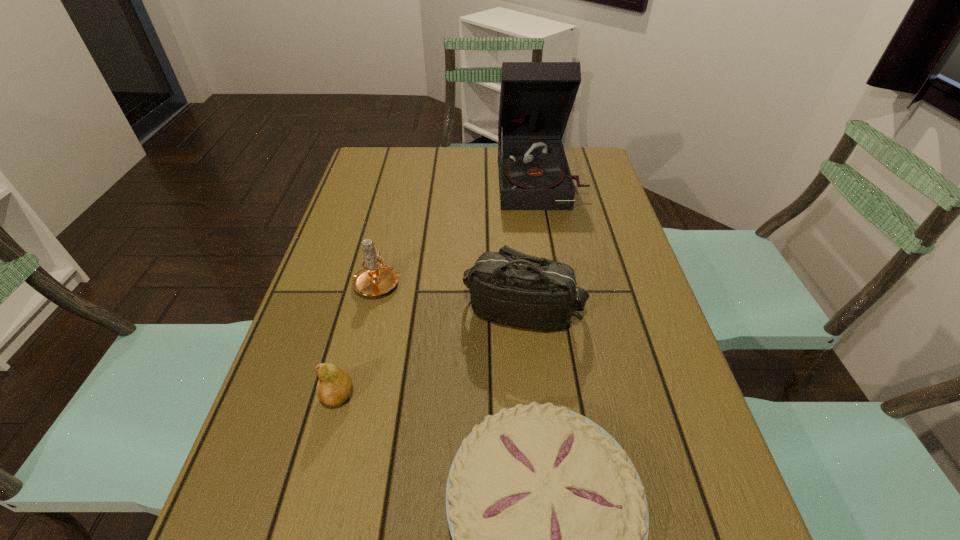
Locate an element on the screen. The image size is (960, 540). free space between the pear and the fourth shortest object is located at coordinates (431, 354).

The image size is (960, 540). Identify the location of free spot between the fourth farthest object and the candle. (358, 338).

You are a GUI agent. You are given a task and a screenshot of the screen. Output one action in this format:
    pyautogui.click(x=<x>, y=<y>)
    Task: Click on the free space between the second tallest object and the fourth farthest object
    
    Given the screenshot: What is the action you would take?
    pyautogui.click(x=431, y=354)

I want to click on vacant space in between the pear and the farthest object, so click(x=440, y=287).

Find the location of a particular element. free space between the fourth shortest object and the fourth farthest object is located at coordinates (431, 354).

This screenshot has height=540, width=960. I want to click on empty space between the tallest object and the shoulder bag, so click(x=532, y=245).

I want to click on empty space between the third tallest object and the shoulder bag, so click(x=450, y=296).

Where is `the fourth closest object relative to the pear`? Image resolution: width=960 pixels, height=540 pixels. the fourth closest object relative to the pear is located at coordinates pyautogui.click(x=536, y=98).

You are a GUI agent. You are given a task and a screenshot of the screen. Output one action in this format:
    pyautogui.click(x=<x>, y=<y>)
    Task: Click on the object that ranks as the second closest to the phonograph_record
    This screenshot has width=960, height=540.
    Given the screenshot: What is the action you would take?
    pyautogui.click(x=374, y=278)